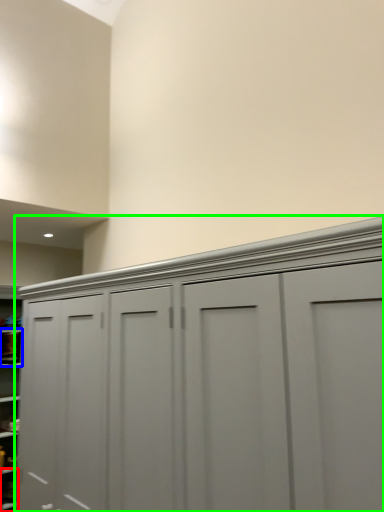
Question: Which object is the closest to the cabinet (highlighted by a red box)? Choose among these: cabinet (highlighted by a blue box) or cupboard (highlighted by a green box).

Choices:
 (A) cabinet
 (B) cupboard

Answer: (A)